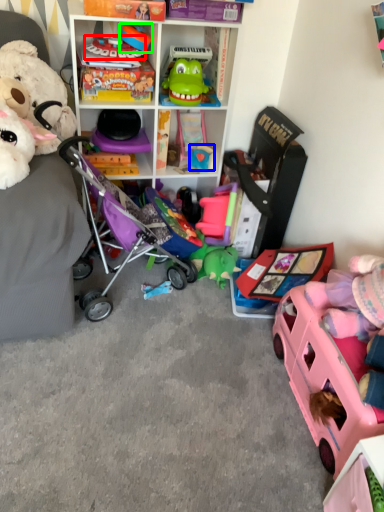
Question: Which is farther away from toy (highlighted by a red box)? toy (highlighted by a blue box) or toy (highlighted by a green box)?

Choices:
 (A) toy
 (B) toy

Answer: (A)